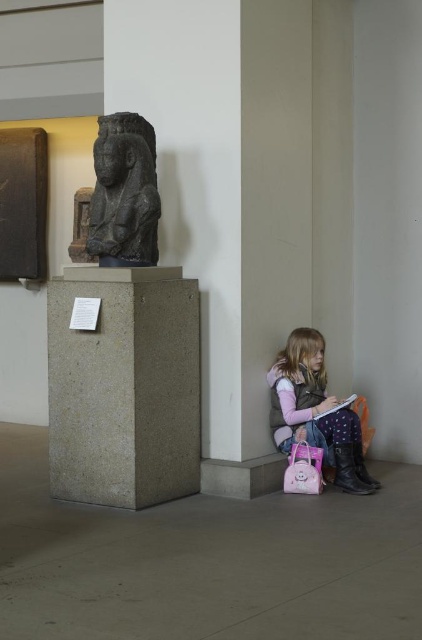
You are a museum visitor who wants to place your pink matte book at lower right on the floor next to the matte pink backpack at lower right. Can you confirm if there is enough space between them for the book?

The matte pink backpack at lower right is closer to the viewer than the pink matte book at lower right, so placing the book next to the backpack would require moving the backpack forward to make space.

You are an interior designer planning to place a new rug in the museum. The rug is exactly the same size as the pink matte book at lower right. Will the rug fit under the black stone statue at left without overlapping its edges?

The black stone statue at left is bigger than the pink matte book at lower right. Since the rug is the same size as the pink matte book at lower right, it will fit under the black stone statue at left without overlapping because the statue is larger and provides enough space.

You are standing in the museum and want to place a small statue exactly at the point marked as point (124, 387). Is there enough space there to place it without overlapping any existing objects?

The gray concrete pillar at center is located at point (124, 387), so placing the statue there would overlap with the existing gray concrete pillar at center.